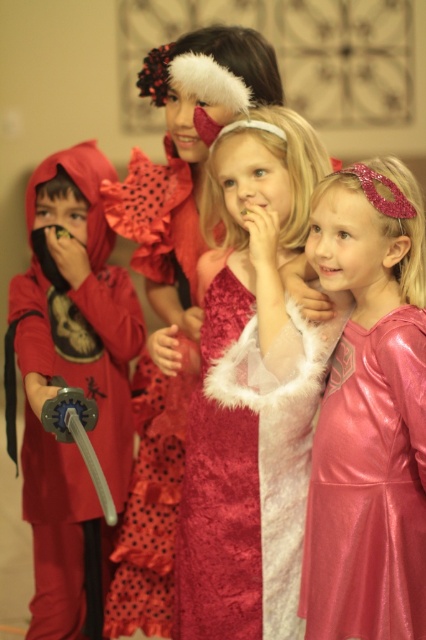
Which child is positioned further to the right between the matte red costume at left and the vibrant red outfit with black polka dots?

The vibrant red outfit with black polka dots is positioned further to the right than the matte red costume at left.

You are a photographer trying to capture the best angle of the two points marked in the image. Which point, point 1 at coordinates (x=408, y=588) or point 2 at (x=273, y=509), would appear larger in your photo?

Point 1 at coordinates (x=408, y=588) would appear larger in the photo because it is closer to the camera than point 2 at (x=273, y=509).